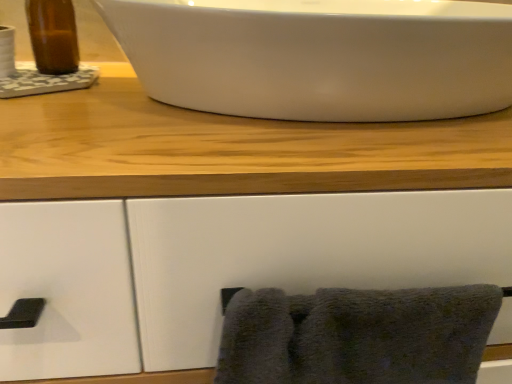
Question: Which direction should I rotate to face white glossy sink at upper center, the 1th sink when ordered from right to left, — up or down?

Choices:
 (A) down
 (B) up

Answer: (B)

Question: Is white glossy sink at upper center, acting as the 2th sink starting from the left, surrounded by brown glass bottle at upper left, the 1th sink when ordered from left to right?

Choices:
 (A) yes
 (B) no

Answer: (B)

Question: From a real-world perspective, is brown glass bottle at upper left, the 1th sink when ordered from left to right, below white glossy sink at upper center, acting as the 2th sink starting from the left?

Choices:
 (A) no
 (B) yes

Answer: (A)

Question: Does brown glass bottle at upper left, the 1th sink when ordered from left to right, appear on the right side of white glossy sink at upper center, acting as the 2th sink starting from the left?

Choices:
 (A) yes
 (B) no

Answer: (B)

Question: Is the depth of brown glass bottle at upper left, the 1th sink when ordered from left to right, less than that of white glossy sink at upper center, the 1th sink when ordered from right to left?

Choices:
 (A) yes
 (B) no

Answer: (B)

Question: From the image's perspective, would you say brown glass bottle at upper left, the 1th sink when ordered from left to right, is shown under white glossy sink at upper center, acting as the 2th sink starting from the left?

Choices:
 (A) yes
 (B) no

Answer: (B)

Question: From a real-world perspective, is brown glass bottle at upper left, the 1th sink when ordered from left to right, over white glossy sink at upper center, the 1th sink when ordered from right to left?

Choices:
 (A) yes
 (B) no

Answer: (A)

Question: Is brown glass bottle at upper left, the second sink in the right-to-left sequence, at the back of white glossy sink at upper center, acting as the 2th sink starting from the left?

Choices:
 (A) yes
 (B) no

Answer: (B)

Question: Is white glossy sink at upper center, the 1th sink when ordered from right to left, taller than brown glass bottle at upper left, the second sink in the right-to-left sequence?

Choices:
 (A) no
 (B) yes

Answer: (A)

Question: Is white glossy sink at upper center, acting as the 2th sink starting from the left, closer to the viewer compared to brown glass bottle at upper left, the second sink in the right-to-left sequence?

Choices:
 (A) no
 (B) yes

Answer: (B)

Question: Is white glossy sink at upper center, acting as the 2th sink starting from the left, wider than brown glass bottle at upper left, the second sink in the right-to-left sequence?

Choices:
 (A) no
 (B) yes

Answer: (B)

Question: Is white glossy sink at upper center, the 1th sink when ordered from right to left, placed right next to brown glass bottle at upper left, the second sink in the right-to-left sequence?

Choices:
 (A) yes
 (B) no

Answer: (B)

Question: Can you confirm if white glossy sink at upper center, acting as the 2th sink starting from the left, is shorter than brown glass bottle at upper left, the 1th sink when ordered from left to right?

Choices:
 (A) yes
 (B) no

Answer: (A)

Question: From a real-world perspective, is brown glass bottle at upper left, the 1th sink when ordered from left to right, on top of dark gray fluffy towel at lower right?

Choices:
 (A) no
 (B) yes

Answer: (B)